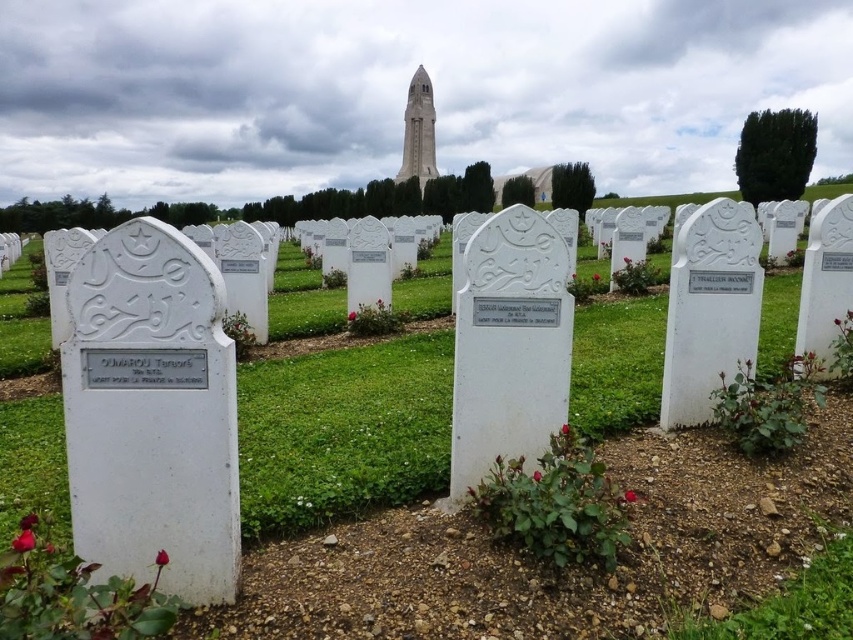
Question: Can you confirm if white marble tombstones at center is smaller than white marble tower at center?

Choices:
 (A) yes
 (B) no

Answer: (B)

Question: Which of the following is the closest to the observer?

Choices:
 (A) white marble tombstones at center
 (B) white marble tower at center

Answer: (A)

Question: Which of the following is the farthest from the observer?

Choices:
 (A) white marble tombstones at center
 (B) white marble tower at center

Answer: (B)

Question: Can you confirm if white marble tombstones at center is positioned above white marble tower at center?

Choices:
 (A) no
 (B) yes

Answer: (A)

Question: Which point is closer to the camera?

Choices:
 (A) (425, 163)
 (B) (332, 596)

Answer: (B)

Question: Can you confirm if white marble tombstones at center is positioned above white marble tower at center?

Choices:
 (A) no
 (B) yes

Answer: (A)